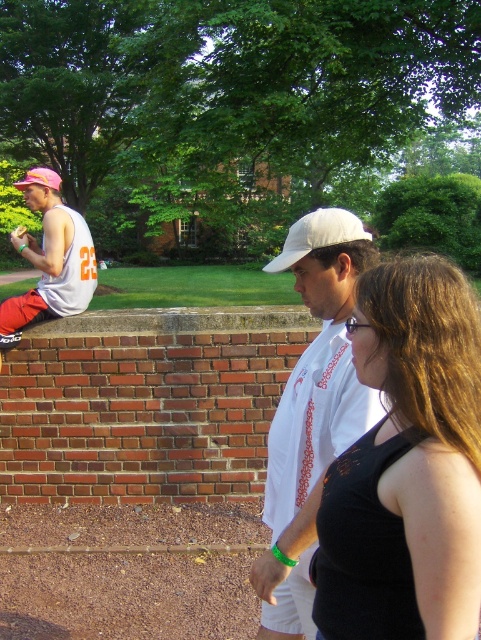
In the park scene, you see two people sitting on a brick wall. One is wearing a white cotton shirt at center and the other a matte white tank top at left. Which person is sitting higher up on the wall?

The matte white tank top at left is sitting higher up on the wall because the white cotton shirt at center is positioned under it.

You are a photographer trying to capture both the white fabric baseball cap at center and the pink fabric baseball hat at left in a single frame. Which of the two hats will appear smaller in the photo?

The white fabric baseball cap at center will appear smaller in the photo because it has a smaller size compared to the pink fabric baseball hat at left.